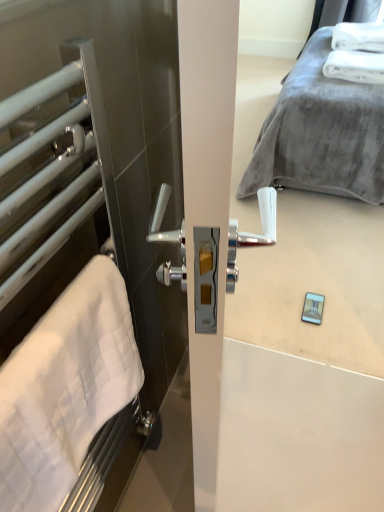
Question: From the image's perspective, is white matte towel rack at left under white soft towel at upper right, the first bath towel positioned from the top?

Choices:
 (A) yes
 (B) no

Answer: (A)

Question: Can white soft towel at upper right, the 2th bath towel ordered from the bottom, be found inside white matte towel rack at left?

Choices:
 (A) no
 (B) yes

Answer: (A)

Question: Does white matte towel rack at left have a larger size compared to white soft towel at upper right, the 2th bath towel ordered from the bottom?

Choices:
 (A) no
 (B) yes

Answer: (B)

Question: Can you confirm if white matte towel rack at left is wider than white soft towel at upper right, positioned as the first bath towel in back-to-front order?

Choices:
 (A) no
 (B) yes

Answer: (A)

Question: From the image's perspective, is white matte towel rack at left on top of white soft towel at upper right, the first bath towel positioned from the top?

Choices:
 (A) yes
 (B) no

Answer: (B)

Question: Considering the relative sizes of white matte towel rack at left and white soft towel at upper right, the second bath towel viewed from the left, in the image provided, is white matte towel rack at left thinner than white soft towel at upper right, the second bath towel viewed from the left,?

Choices:
 (A) yes
 (B) no

Answer: (A)

Question: Is white soft towel at left, marked as the first bath towel in a bottom-to-top arrangement, taller than white soft towel at upper right, the second bath towel viewed from the left?

Choices:
 (A) no
 (B) yes

Answer: (B)

Question: Is the position of white soft towel at left, the second bath towel in the top-to-bottom sequence, less distant than that of white soft towel at upper right, arranged as the second bath towel when viewed from the front?

Choices:
 (A) yes
 (B) no

Answer: (A)

Question: Considering the relative sizes of white soft towel at left, positioned as the second bath towel in right-to-left order, and white soft towel at upper right, the first bath towel positioned from the top, in the image provided, is white soft towel at left, positioned as the second bath towel in right-to-left order, smaller than white soft towel at upper right, the first bath towel positioned from the top,?

Choices:
 (A) yes
 (B) no

Answer: (A)

Question: Is white soft towel at left, positioned as the second bath towel in back-to-front order, far away from white soft towel at upper right, the 1th bath towel positioned from the right?

Choices:
 (A) yes
 (B) no

Answer: (A)

Question: From the image's perspective, does white soft towel at left, acting as the first bath towel starting from the left, appear higher than white soft towel at upper right, arranged as the second bath towel when viewed from the front?

Choices:
 (A) yes
 (B) no

Answer: (B)

Question: From the image's perspective, is white soft towel at left, marked as the first bath towel in a bottom-to-top arrangement, beneath white soft towel at upper right, positioned as the first bath towel in back-to-front order?

Choices:
 (A) yes
 (B) no

Answer: (A)

Question: From a real-world perspective, is white soft towel at upper right, the first bath towel positioned from the top, below white matte towel rack at left?

Choices:
 (A) yes
 (B) no

Answer: (A)